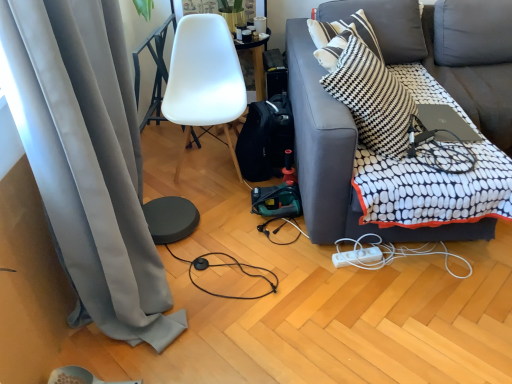
This screenshot has height=384, width=512. Identify the location of vacant area on the back side of white plastic power outlet at lower center. (353, 247).